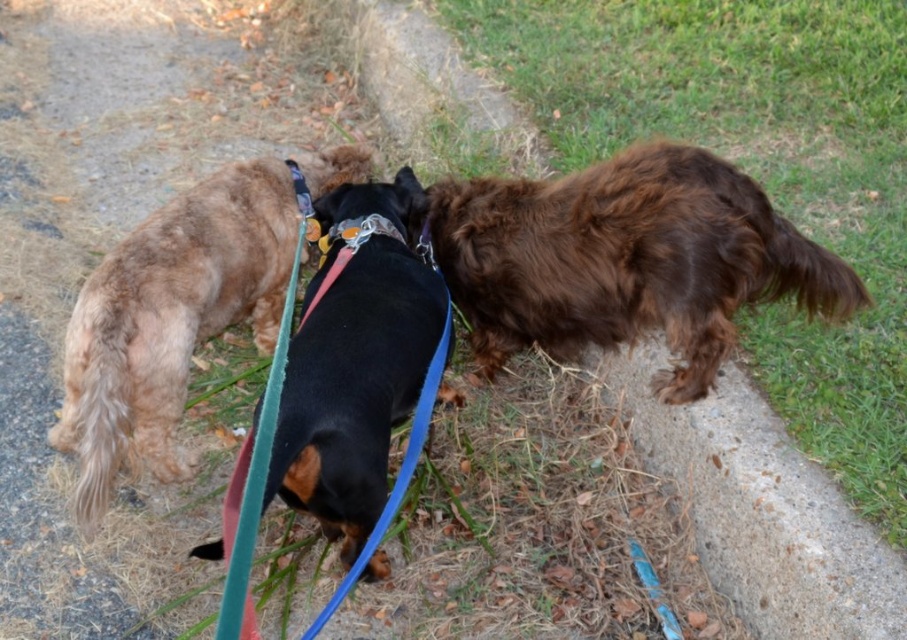
Measure the distance from shiny brown fur at center to metallic silver neckband at center.

10.98 inches

Identify the location of shiny brown fur at center. The height and width of the screenshot is (640, 907). (356, 365).

Is shaggy brown dog at right in front of metallic silver neckband at center?

Yes, shaggy brown dog at right is in front of metallic silver neckband at center.

What do you see at coordinates (625, 259) in the screenshot? I see `shaggy brown dog at right` at bounding box center [625, 259].

The width and height of the screenshot is (907, 640). What are the coordinates of `shaggy brown dog at right` in the screenshot? It's located at (625, 259).

Which is in front, point (875, 100) or point (376, 484)?

Point (376, 484) is more forward.

Who is lower down, brown furry dog at right or shiny brown fur at center?

shiny brown fur at center is lower down.

Who is more forward, (524, 74) or (389, 384)?

Point (389, 384) is in front.

Where is `brown furry dog at right`? brown furry dog at right is located at coordinates (753, 172).